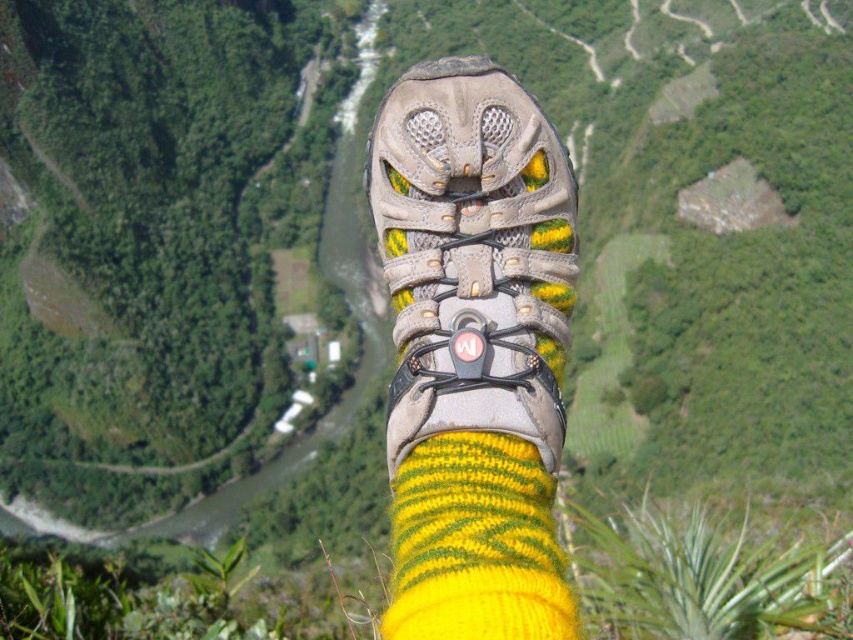
Is matte gray shoe at center thinner than yellow knitted sock at center?

No, matte gray shoe at center is not thinner than yellow knitted sock at center.

Can you confirm if matte gray shoe at center is taller than yellow knitted sock at center?

Yes.

Describe the element at coordinates (473, 257) in the screenshot. Image resolution: width=853 pixels, height=640 pixels. I see `matte gray shoe at center` at that location.

Locate an element on the screen. The image size is (853, 640). matte gray shoe at center is located at coordinates (473, 257).